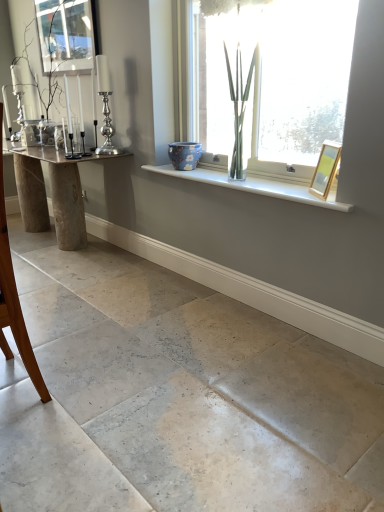
Question: Does white glossy window sill at upper center have a greater height compared to natural stone table at left?

Choices:
 (A) yes
 (B) no

Answer: (B)

Question: Is white glossy window sill at upper center positioned with its back to natural stone table at left?

Choices:
 (A) no
 (B) yes

Answer: (A)

Question: Is white glossy window sill at upper center with natural stone table at left?

Choices:
 (A) no
 (B) yes

Answer: (A)

Question: Could natural stone table at left be considered to be inside white glossy window sill at upper center?

Choices:
 (A) no
 (B) yes

Answer: (A)

Question: Does white glossy window sill at upper center turn towards natural stone table at left?

Choices:
 (A) yes
 (B) no

Answer: (B)

Question: Is white glossy window sill at upper center to the right of natural stone table at left from the viewer's perspective?

Choices:
 (A) yes
 (B) no

Answer: (A)

Question: Is transparent glass vase at upper center smaller than clear glass window screen at upper left?

Choices:
 (A) no
 (B) yes

Answer: (A)

Question: From the image's perspective, is transparent glass vase at upper center on clear glass window screen at upper left?

Choices:
 (A) no
 (B) yes

Answer: (A)

Question: Would you say transparent glass vase at upper center is outside clear glass window screen at upper left?

Choices:
 (A) yes
 (B) no

Answer: (A)

Question: From a real-world perspective, is transparent glass vase at upper center located higher than clear glass window screen at upper left?

Choices:
 (A) no
 (B) yes

Answer: (A)

Question: Is clear glass window screen at upper left surrounded by transparent glass vase at upper center?

Choices:
 (A) yes
 (B) no

Answer: (B)

Question: Are transparent glass vase at upper center and clear glass window screen at upper left far apart?

Choices:
 (A) no
 (B) yes

Answer: (B)

Question: From a real-world perspective, does brown wooden chair at left sit lower than wooden picture frame at upper right?

Choices:
 (A) no
 (B) yes

Answer: (B)